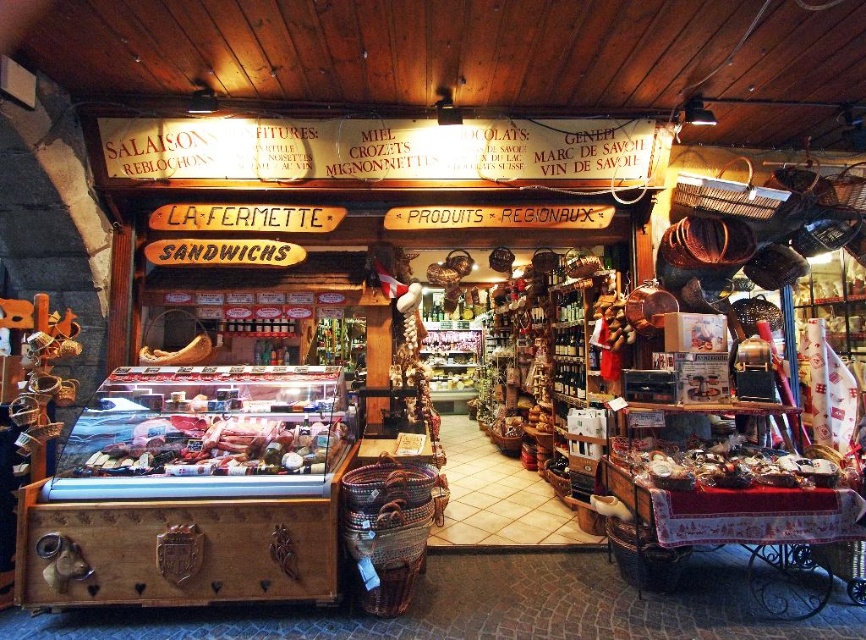
Does shiny pink meat at center have a lesser width compared to shiny metallic trinkets at lower right?

In fact, shiny pink meat at center might be wider than shiny metallic trinkets at lower right.

Which of these two, shiny pink meat at center or shiny metallic trinkets at lower right, stands taller?

With more height is shiny pink meat at center.

Is point (153, 422) in front of point (779, 477)?

No.

At what (x,y) coordinates should I click in order to perform the action: click on shiny pink meat at center. Please return your answer as a coordinate pair (x, y). Looking at the image, I should click on (204, 444).

Is shiny pink meat at center positioned at the back of matte brown cheese at center left?

No, shiny pink meat at center is in front of matte brown cheese at center left.

Which is below, shiny pink meat at center or matte brown cheese at center left?

shiny pink meat at center is below.

What do you see at coordinates (204, 444) in the screenshot?
I see `shiny pink meat at center` at bounding box center [204, 444].

You are a GUI agent. You are given a task and a screenshot of the screen. Output one action in this format:
    pyautogui.click(x=<x>, y=<y>)
    Task: Click on the shiny pink meat at center
    The image size is (866, 640).
    Given the screenshot: What is the action you would take?
    pyautogui.click(x=204, y=444)

Who is lower down, shiny metallic trinkets at lower right or matte brown cheese at center left?

Positioned lower is shiny metallic trinkets at lower right.

Does point (734, 486) come behind point (207, 346)?

No.

Locate an element on the screen. The width and height of the screenshot is (866, 640). shiny metallic trinkets at lower right is located at coordinates (727, 467).